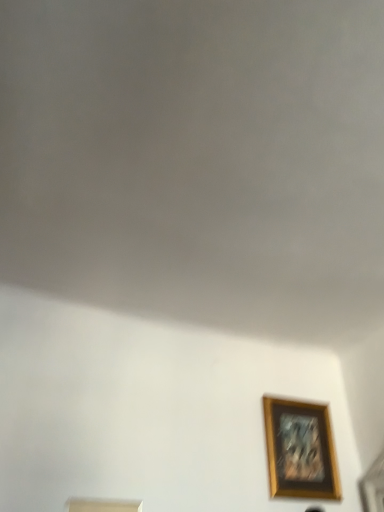
Measure the distance between point (x=303, y=418) and camera.

Point (x=303, y=418) and camera are 1.82 meters apart from each other.

Locate an element on the screen. wooden picture frame at lower right is located at coordinates click(x=300, y=450).

What do you see at coordinates (300, 450) in the screenshot? This screenshot has width=384, height=512. I see `wooden picture frame at lower right` at bounding box center [300, 450].

Where is `wooden picture frame at lower right`? This screenshot has height=512, width=384. wooden picture frame at lower right is located at coordinates tap(300, 450).